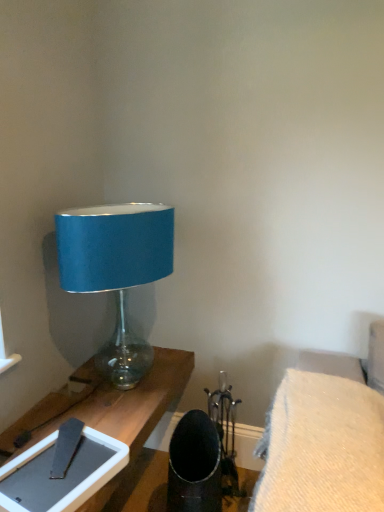
Question: Is matte gray tablet at lower left aimed at blue fabric lampshade at left?

Choices:
 (A) no
 (B) yes

Answer: (A)

Question: Can you confirm if matte gray tablet at lower left is wider than blue fabric lampshade at left?

Choices:
 (A) no
 (B) yes

Answer: (A)

Question: Can you confirm if matte gray tablet at lower left is positioned to the left of blue fabric lampshade at left?

Choices:
 (A) yes
 (B) no

Answer: (A)

Question: From a real-world perspective, does matte gray tablet at lower left stand above blue fabric lampshade at left?

Choices:
 (A) yes
 (B) no

Answer: (B)

Question: Can blue fabric lampshade at left be found inside matte gray tablet at lower left?

Choices:
 (A) yes
 (B) no

Answer: (B)

Question: Is point click(x=365, y=393) positioned closer to the camera than point click(x=129, y=273)?

Choices:
 (A) closer
 (B) farther

Answer: (A)

Question: In terms of size, does woolen fabric cushion at lower right appear bigger or smaller than blue fabric lampshade at left?

Choices:
 (A) small
 (B) big

Answer: (A)

Question: Is woolen fabric cushion at lower right inside the boundaries of blue fabric lampshade at left, or outside?

Choices:
 (A) inside
 (B) outside

Answer: (B)

Question: Visually, is woolen fabric cushion at lower right positioned to the left or to the right of blue fabric lampshade at left?

Choices:
 (A) right
 (B) left

Answer: (A)

Question: From a real-world perspective, is blue fabric lampshade at left physically located above or below woolen fabric cushion at lower right?

Choices:
 (A) below
 (B) above

Answer: (B)

Question: Based on their sizes in the image, would you say blue fabric lampshade at left is bigger or smaller than woolen fabric cushion at lower right?

Choices:
 (A) small
 (B) big

Answer: (B)

Question: Does point (127, 374) appear closer or farther from the camera than point (322, 501)?

Choices:
 (A) closer
 (B) farther

Answer: (B)

Question: In terms of height, does blue fabric lampshade at left look taller or shorter compared to woolen fabric cushion at lower right?

Choices:
 (A) short
 (B) tall

Answer: (B)

Question: Is blue fabric lampshade at left to the left or to the right of matte gray tablet at lower left in the image?

Choices:
 (A) left
 (B) right

Answer: (B)

Question: Is blue fabric lampshade at left in front of or behind matte gray tablet at lower left in the image?

Choices:
 (A) behind
 (B) front

Answer: (A)